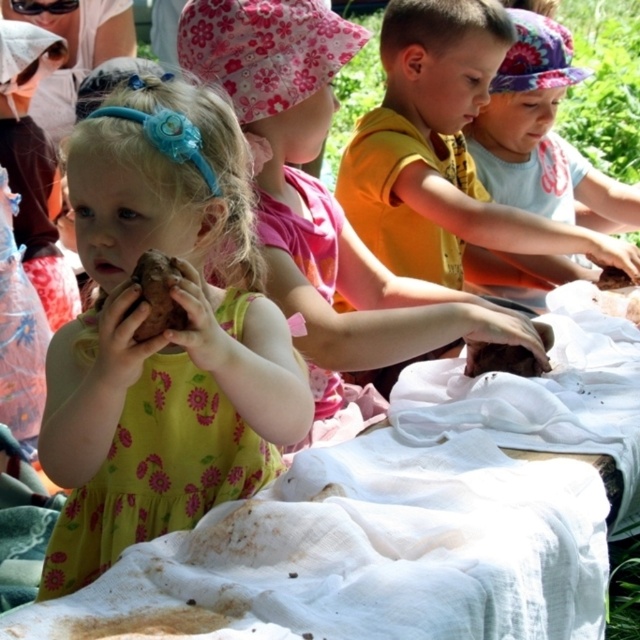
You are a farmer who wants to plant potatoes. You have two potatoes in front of you, a matte brown potato at center and a brown matte potato at center. Which potato is wider?

The matte brown potato at center is wider than the brown matte potato at center.

You are a photographer trying to capture a closeup shot of the yellow floral dress at center and the smooth brown clay at center. Which object should you zoom in on to ensure it fills more of the frame without moving the camera?

The smooth brown clay at center is larger in size compared to the yellow floral dress at center, so zooming in on it will fill more of the frame.

You are a farmer who wants to plant seeds in the brown matte clay at center and brown matte potato at center. Which object should you choose to plant seeds in?

The brown matte clay at center should be chosen to plant seeds because the brown matte potato at center is larger and likely not suitable for planting seeds.